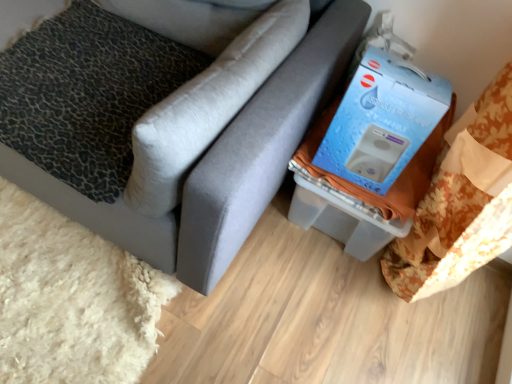
Locate an element on the screen. This screenshot has width=512, height=384. matte gray couch at center is located at coordinates (224, 163).

What do you see at coordinates (224, 163) in the screenshot? I see `matte gray couch at center` at bounding box center [224, 163].

Measure the distance between leopard print fabric pillow at left, which is counted as the second pillow, starting from the left, and camera.

leopard print fabric pillow at left, which is counted as the second pillow, starting from the left, and camera are 31.60 inches apart.

Measure the distance between point (73, 104) and camera.

Point (73, 104) is 3.89 feet from camera.

You are a GUI agent. You are given a task and a screenshot of the screen. Output one action in this format:
    pyautogui.click(x=<x>, y=<y>)
    Task: Click on the matte gray couch at center
    
    Given the screenshot: What is the action you would take?
    pyautogui.click(x=224, y=163)

Which object is thinner, leopard print fabric pillow at left, the first pillow from the right, or matte gray couch at center?

leopard print fabric pillow at left, the first pillow from the right.

From a real-world perspective, is leopard print fabric pillow at left, which is counted as the second pillow, starting from the left, on top of matte gray couch at center?

Yes, from a real-world perspective, leopard print fabric pillow at left, which is counted as the second pillow, starting from the left, is over matte gray couch at center

Does leopard print fabric pillow at left, the first pillow from the right, have a greater height compared to matte gray couch at center?

No.

From the image's perspective, starting from the blue cardboard box at upper right, which pillow is the 1st one above? Please provide its 2D coordinates.

[(207, 107)]

Looking at this image, considering the positions of objects blue cardboard box at upper right and leopard print fabric pillow at left, the first pillow from the right, in the image provided, who is behind, blue cardboard box at upper right or leopard print fabric pillow at left, the first pillow from the right,?

blue cardboard box at upper right is more distant.

From a real-world perspective, is blue cardboard box at upper right positioned over leopard print fabric pillow at left, which is counted as the second pillow, starting from the left, based on gravity?

Yes, from a real-world perspective, blue cardboard box at upper right is above leopard print fabric pillow at left, which is counted as the second pillow, starting from the left.

Is matte gray couch at center in front of or behind leopard print fabric pillow at left, the first pillow from the right, in the image?

Visually, matte gray couch at center is located in front of leopard print fabric pillow at left, the first pillow from the right.

Between matte gray couch at center and leopard print fabric pillow at left, which is counted as the second pillow, starting from the left, which one has more height?

matte gray couch at center.

From the image's perspective, which is above, matte gray couch at center or leopard print fabric pillow at left, the first pillow from the right?

matte gray couch at center appears higher in the image.

Which object is positioned more to the right, leopard print fabric pillow at left, which is counted as the second pillow, starting from the left, or blue cardboard box at upper right?

From the viewer's perspective, blue cardboard box at upper right appears more on the right side.

Is the position of leopard print fabric pillow at left, the first pillow from the right, less distant than that of blue cardboard box at upper right?

Yes, leopard print fabric pillow at left, the first pillow from the right, is closer to the camera.

Between leopard print fabric pillow at left, the first pillow from the right, and blue cardboard box at upper right, which one has smaller width?

blue cardboard box at upper right.

Measure the distance between leopard print fabric pillow at left, the first pillow from the right, and blue cardboard box at upper right.

They are 15.25 inches apart.

Is leopard print fabric pillow at left, the first pillow in the left-to-right sequence, to the right of matte gray couch at center from the viewer's perspective?

Correct, you'll find leopard print fabric pillow at left, the first pillow in the left-to-right sequence, to the right of matte gray couch at center.

This screenshot has width=512, height=384. I want to click on furniture on the left of leopard print fabric pillow at left, the first pillow in the left-to-right sequence, so click(x=224, y=163).

Which is behind, point (74, 150) or point (354, 3)?

The point (354, 3) is farther from the camera.

Is leopard print fabric pillow at left, which is the 2th pillow in right-to-left order, placed right next to matte gray couch at center?

No, leopard print fabric pillow at left, which is the 2th pillow in right-to-left order, is not making contact with matte gray couch at center.

Could you tell me if leopard print fabric pillow at left, which is counted as the second pillow, starting from the left, is facing leopard print fabric pillow at left, the first pillow in the left-to-right sequence?

No, leopard print fabric pillow at left, which is counted as the second pillow, starting from the left, is not aimed at leopard print fabric pillow at left, the first pillow in the left-to-right sequence.

Is leopard print fabric pillow at left, the first pillow from the right, to the right of leopard print fabric pillow at left, which is the 2th pillow in right-to-left order, from the viewer's perspective?

Correct, you'll find leopard print fabric pillow at left, the first pillow from the right, to the right of leopard print fabric pillow at left, which is the 2th pillow in right-to-left order.

Does leopard print fabric pillow at left, which is counted as the second pillow, starting from the left, have a smaller size compared to leopard print fabric pillow at left, the first pillow in the left-to-right sequence?

Incorrect, leopard print fabric pillow at left, which is counted as the second pillow, starting from the left, is not smaller in size than leopard print fabric pillow at left, the first pillow in the left-to-right sequence.

Considering the points (236, 195) and (46, 44), which point is behind, point (236, 195) or point (46, 44)?

Positioned behind is point (46, 44).

Is leopard print fabric pillow at left, which is the 2th pillow in right-to-left order, surrounded by matte gray couch at center?

Yes, matte gray couch at center is surrounding leopard print fabric pillow at left, which is the 2th pillow in right-to-left order.

From the image's perspective, is matte gray couch at center on leopard print fabric pillow at left, the first pillow in the left-to-right sequence?

Yes.

Can you confirm if matte gray couch at center is taller than leopard print fabric pillow at left, the first pillow in the left-to-right sequence?

Yes, matte gray couch at center is taller than leopard print fabric pillow at left, the first pillow in the left-to-right sequence.

Where is `furniture that is on the left side of leopard print fabric pillow at left, which is counted as the second pillow, starting from the left`? The height and width of the screenshot is (384, 512). furniture that is on the left side of leopard print fabric pillow at left, which is counted as the second pillow, starting from the left is located at coordinates (224, 163).

The width and height of the screenshot is (512, 384). Identify the location of storage box above the leopard print fabric pillow at left, which is counted as the second pillow, starting from the left (from a real-world perspective). (381, 135).

Based on their spatial positions, is leopard print fabric pillow at left, which is counted as the second pillow, starting from the left, or leopard print fabric pillow at left, the first pillow in the left-to-right sequence, closer to blue cardboard box at upper right?

The object closer to blue cardboard box at upper right is leopard print fabric pillow at left, which is counted as the second pillow, starting from the left.

Which object lies further to the anchor point leopard print fabric pillow at left, the first pillow in the left-to-right sequence, matte gray couch at center or leopard print fabric pillow at left, which is counted as the second pillow, starting from the left?

leopard print fabric pillow at left, which is counted as the second pillow, starting from the left.

When comparing their distances from leopard print fabric pillow at left, the first pillow in the left-to-right sequence, does matte gray couch at center or blue cardboard box at upper right seem closer?

matte gray couch at center lies closer to leopard print fabric pillow at left, the first pillow in the left-to-right sequence, than the other object.

Looking at the image, which one is located further to leopard print fabric pillow at left, which is counted as the second pillow, starting from the left, blue cardboard box at upper right or leopard print fabric pillow at left, which is the 2th pillow in right-to-left order?

The object further to leopard print fabric pillow at left, which is counted as the second pillow, starting from the left, is blue cardboard box at upper right.

Which object lies further to the anchor point matte gray couch at center, leopard print fabric pillow at left, which is counted as the second pillow, starting from the left, or leopard print fabric pillow at left, which is the 2th pillow in right-to-left order?

The object further to matte gray couch at center is leopard print fabric pillow at left, which is the 2th pillow in right-to-left order.

Based on their spatial positions, is matte gray couch at center or leopard print fabric pillow at left, which is the 2th pillow in right-to-left order, closer to leopard print fabric pillow at left, the first pillow from the right?

matte gray couch at center.

When comparing their distances from blue cardboard box at upper right, does leopard print fabric pillow at left, the first pillow in the left-to-right sequence, or leopard print fabric pillow at left, which is counted as the second pillow, starting from the left, seem further?

leopard print fabric pillow at left, the first pillow in the left-to-right sequence.

From the image, which object appears to be nearer to blue cardboard box at upper right, matte gray couch at center or leopard print fabric pillow at left, the first pillow in the left-to-right sequence?

Based on the image, matte gray couch at center appears to be nearer to blue cardboard box at upper right.

I want to click on pillow between leopard print fabric pillow at left, which is the 2th pillow in right-to-left order, and blue cardboard box at upper right, in the horizontal direction, so click(207, 107).

Find the location of a particular element. pillow situated between matte gray couch at center and leopard print fabric pillow at left, which is counted as the second pillow, starting from the left, from left to right is located at coordinates (87, 94).